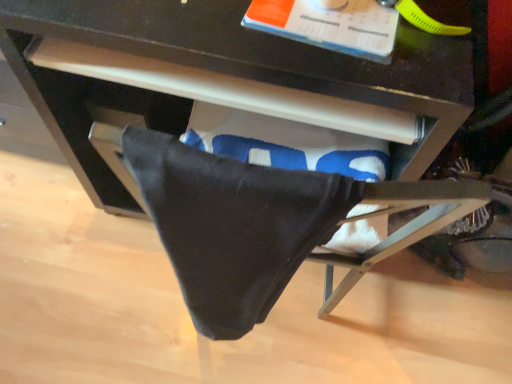
Question: Is black cotton towel at lower center a part of matte black drawer at center?

Choices:
 (A) no
 (B) yes

Answer: (A)

Question: Can you confirm if matte black drawer at center is positioned to the left of black cotton towel at lower center?

Choices:
 (A) yes
 (B) no

Answer: (A)

Question: Can you confirm if matte black drawer at center is smaller than black cotton towel at lower center?

Choices:
 (A) no
 (B) yes

Answer: (A)

Question: Is matte black drawer at center touching black cotton towel at lower center?

Choices:
 (A) no
 (B) yes

Answer: (A)

Question: Does matte black drawer at center have a greater width compared to black cotton towel at lower center?

Choices:
 (A) no
 (B) yes

Answer: (B)

Question: Is the position of matte black drawer at center more distant than that of black cotton towel at lower center?

Choices:
 (A) yes
 (B) no

Answer: (A)

Question: Is black cotton towel at lower center smaller than matte black drawer at center?

Choices:
 (A) no
 (B) yes

Answer: (B)

Question: Can you confirm if black cotton towel at lower center is thinner than matte black drawer at center?

Choices:
 (A) yes
 (B) no

Answer: (A)

Question: Is black cotton towel at lower center shorter than matte black drawer at center?

Choices:
 (A) yes
 (B) no

Answer: (A)

Question: Is matte black drawer at center at the back of black cotton towel at lower center?

Choices:
 (A) no
 (B) yes

Answer: (B)

Question: Is black cotton towel at lower center in contact with matte black drawer at center?

Choices:
 (A) yes
 (B) no

Answer: (B)

Question: Considering the relative sizes of black cotton towel at lower center and matte black drawer at center in the image provided, is black cotton towel at lower center wider than matte black drawer at center?

Choices:
 (A) no
 (B) yes

Answer: (A)

Question: Is black cotton towel at lower center in front of or behind matte black drawer at center in the image?

Choices:
 (A) behind
 (B) front

Answer: (B)